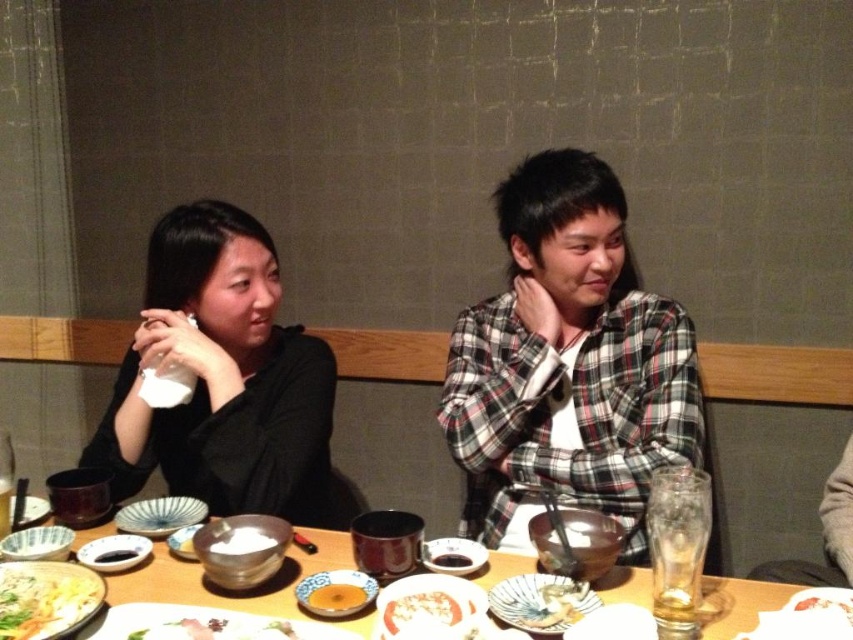
Looking at this image, you are a server at the restaurant and need to deliver a drink to the customer seated at the table. The drink needs to be placed on the plate that is closest to the customer. Which plate should you choose between the matte white plate at center and the porcelain plate at center?

The matte white plate at center is in front of the porcelain plate at center, so the matte white plate at center is closer to the customer and should be chosen for placing the drink.